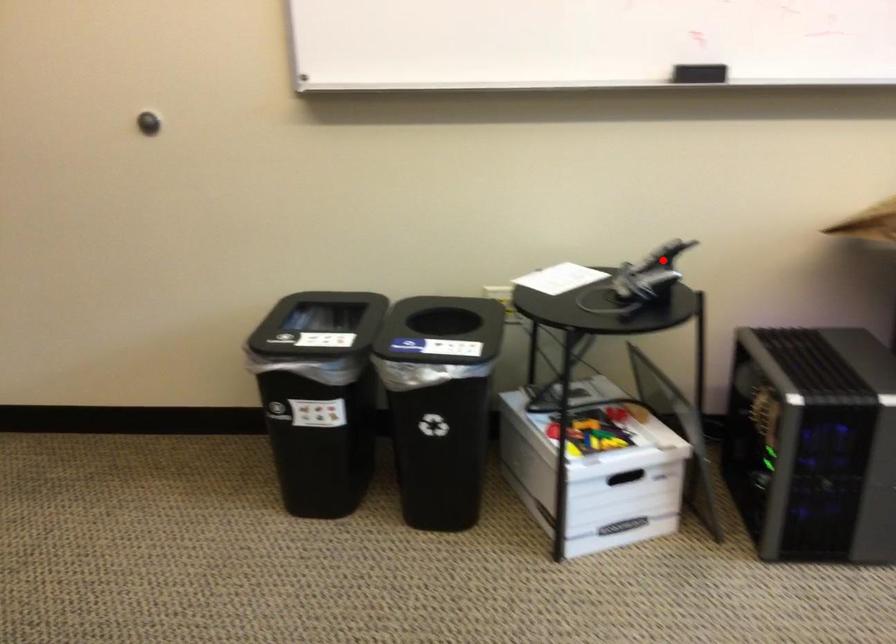
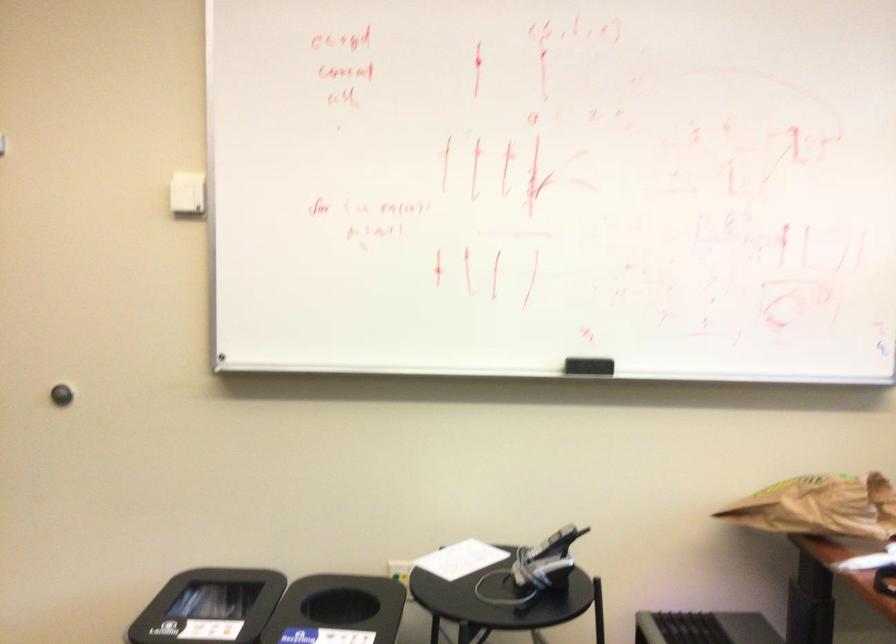
The point at the highlighted location is marked in the first image. Where is the corresponding point in the second image?

(552, 544)